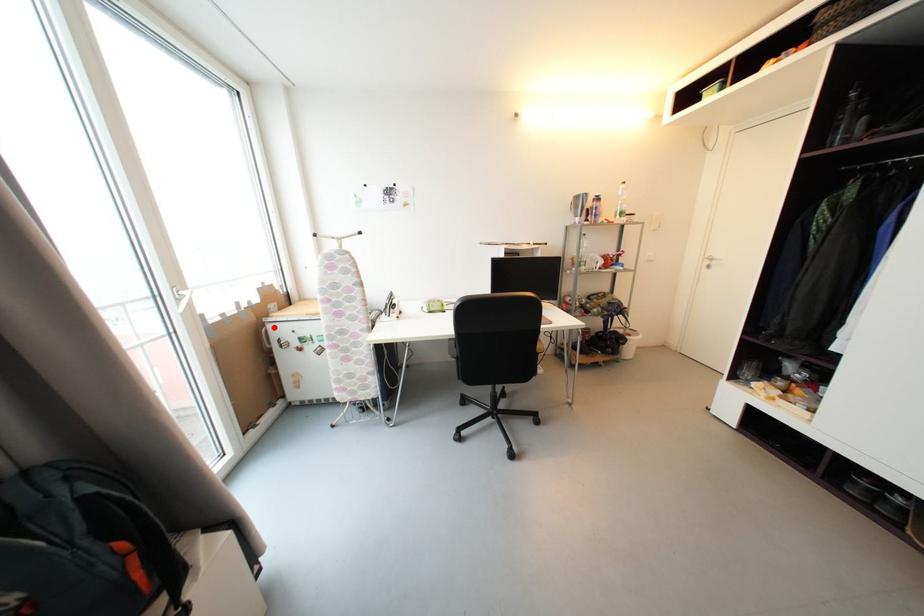
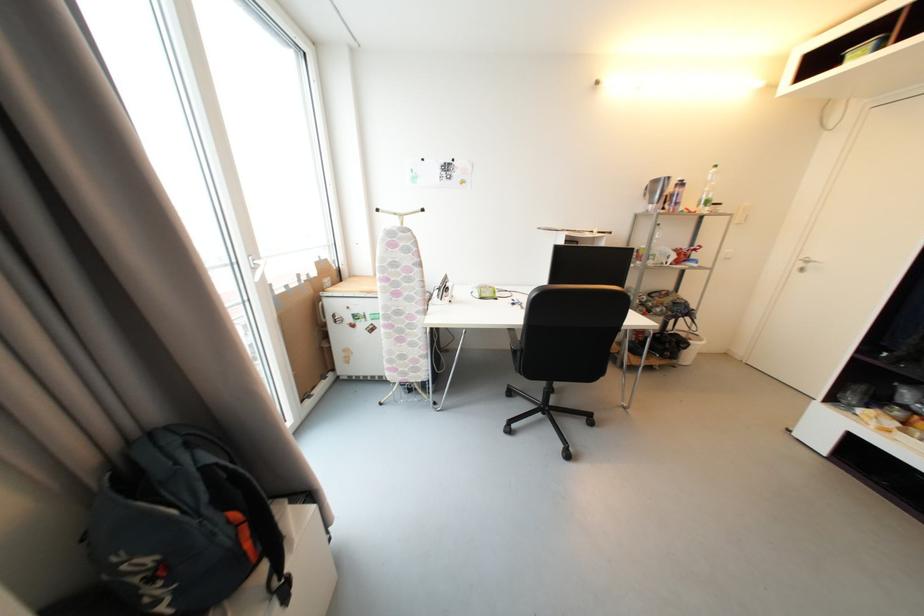
Locate, in the second image, the point that corresponds to the highlighted location in the first image.

(330, 302)